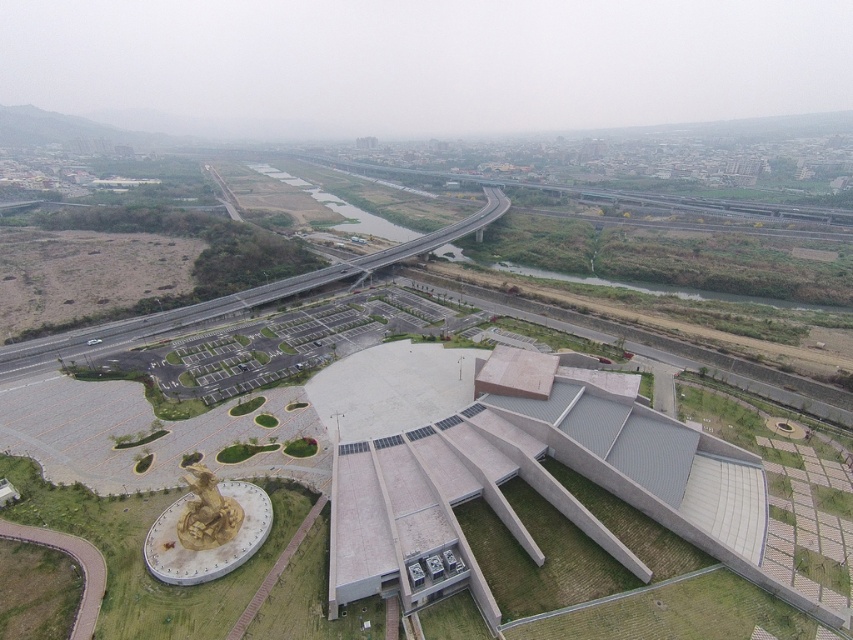
What do you see at coordinates (506, 468) in the screenshot?
I see `gray concrete building at center` at bounding box center [506, 468].

Between point (595, 481) and point (268, 509), which one is positioned in front?

Point (268, 509)

Who is more forward, (705, 504) or (265, 518)?

Point (265, 518) is more forward.

Identify the location of gray concrete building at center. The image size is (853, 640). (506, 468).